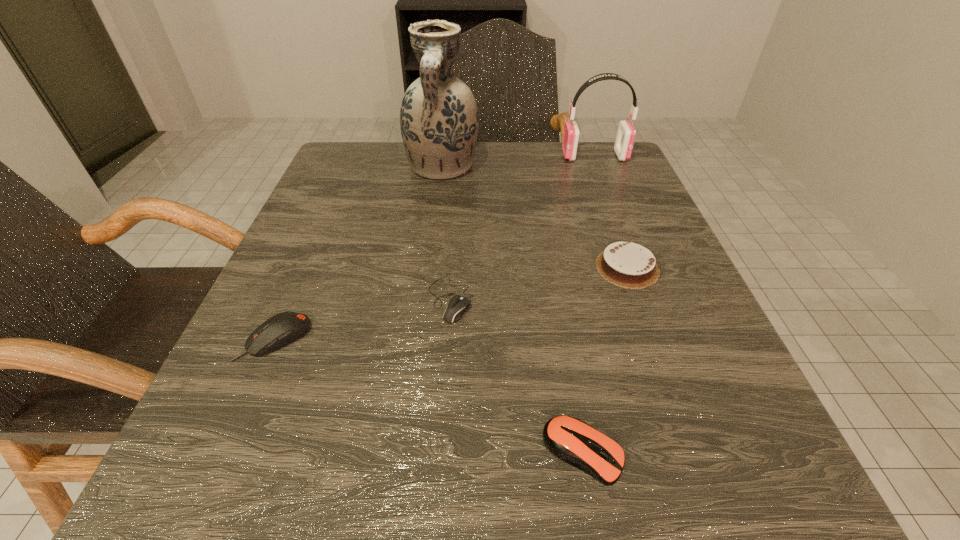
I want to click on earphone that is at the right edge, so [626, 133].

In order to click on chocolate cake situated at the right edge in this screenshot , I will do (625, 264).

The image size is (960, 540). What are the coordinates of `object that is at the far right corner` in the screenshot? It's located at point(626,133).

The height and width of the screenshot is (540, 960). What are the coordinates of `free region at the far edge` in the screenshot? It's located at (531, 181).

This screenshot has height=540, width=960. In the image, there is a desktop. Find the location of `vacant space at the left edge`. vacant space at the left edge is located at coordinates (349, 198).

Where is `vacant space at the right edge`? Image resolution: width=960 pixels, height=540 pixels. vacant space at the right edge is located at coordinates (592, 226).

Identify the location of vacant space at the near left corner of the desktop. (234, 508).

Where is `vacant space at the far right corner of the desktop`? The height and width of the screenshot is (540, 960). vacant space at the far right corner of the desktop is located at coordinates (623, 175).

Image resolution: width=960 pixels, height=540 pixels. In the image, there is a desktop. What are the coordinates of `vacant space at the near right corner` in the screenshot? It's located at (756, 470).

The height and width of the screenshot is (540, 960). I want to click on vacant area that lies between the leftmost object and the vase, so click(x=358, y=253).